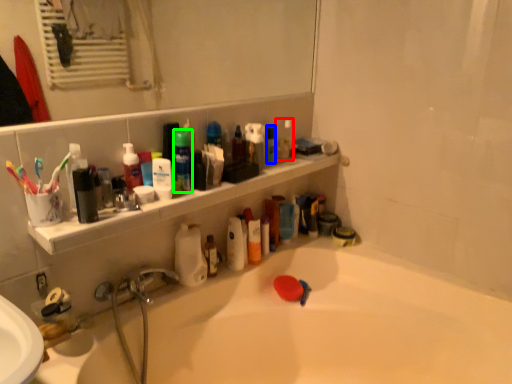
Question: Estimate the real-world distances between objects in this image. Which object is closer to toiletry (highlighted by a red box), toiletry (highlighted by a blue box) or mouthwash (highlighted by a green box)?

Choices:
 (A) toiletry
 (B) mouthwash

Answer: (A)